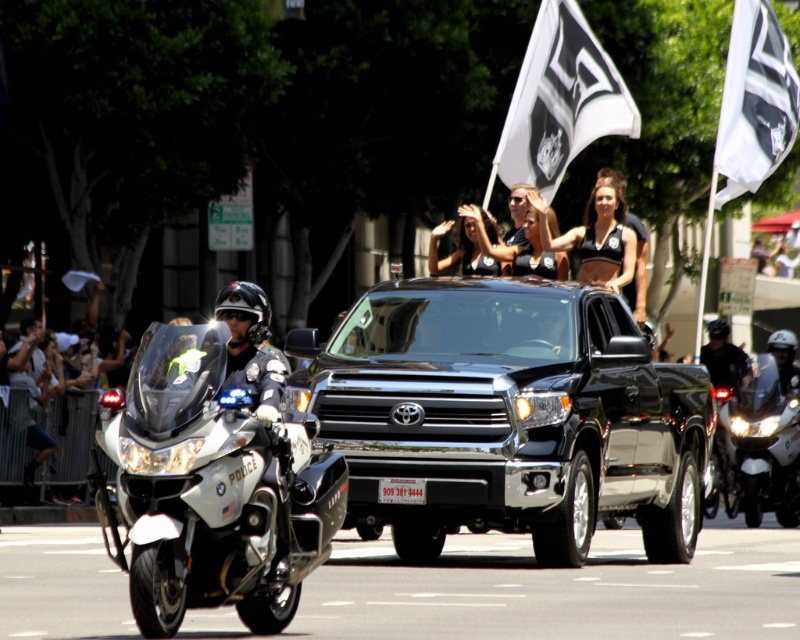
Question: Can you confirm if black metallic truck at center is bigger than white fabric flag at upper right?

Choices:
 (A) yes
 (B) no

Answer: (A)

Question: Which point appears closest to the camera in this image?

Choices:
 (A) (204, 476)
 (B) (486, 212)

Answer: (A)

Question: Is black metallic truck at center wider than white glossy police motorcycle at left?

Choices:
 (A) no
 (B) yes

Answer: (B)

Question: Which object is the closest to the white glossy motorcycle at right?

Choices:
 (A) white fabric flag at upper right
 (B) black matte uniform at center
 (C) black metallic truck at center

Answer: (A)

Question: Among these points, which one is farthest from the camera?

Choices:
 (A) (472, 273)
 (B) (596, 241)
 (C) (404, 291)
 (D) (784, 150)

Answer: (D)

Question: Is black metallic truck at center smaller than black matte uniform at center?

Choices:
 (A) no
 (B) yes

Answer: (A)